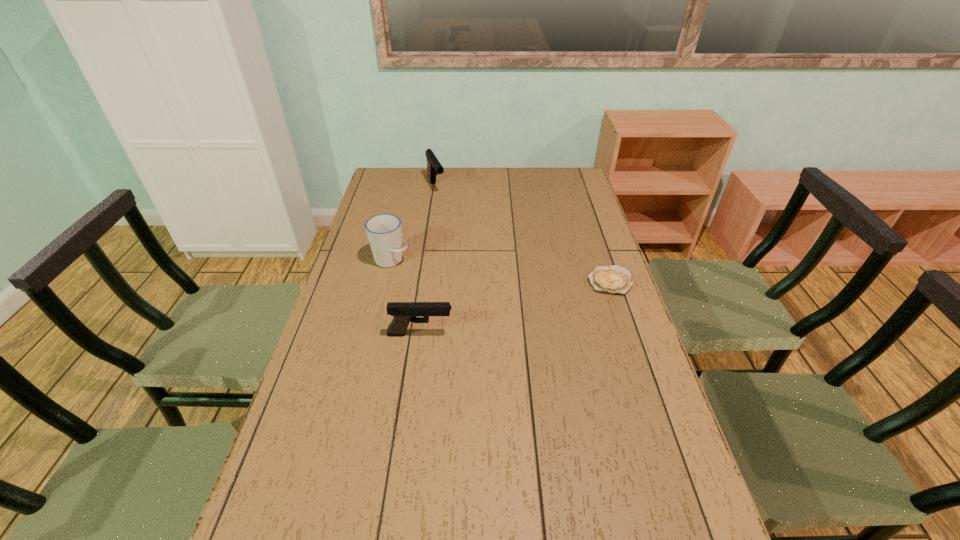
The height and width of the screenshot is (540, 960). In order to click on vacant space at the right edge of the desktop in this screenshot , I will do `click(651, 459)`.

Find the location of a particular element. vacant region at the far left corner of the desktop is located at coordinates (409, 175).

Locate an element on the screen. free area in between the third tallest object and the farther pistol is located at coordinates (428, 261).

You are a GUI agent. You are given a task and a screenshot of the screen. Output one action in this format:
    pyautogui.click(x=<x>, y=<y>)
    Task: Click on the vacant space that is in between the nearest object and the quiche
    The width and height of the screenshot is (960, 540).
    Given the screenshot: What is the action you would take?
    pyautogui.click(x=515, y=307)

Find the location of a particular element. Image resolution: width=960 pixels, height=540 pixels. vacant area that lies between the taller pistol and the rightmost object is located at coordinates (523, 234).

You are a GUI agent. You are given a task and a screenshot of the screen. Output one action in this format:
    pyautogui.click(x=<x>, y=<y>)
    Task: Click on the empty space that is in between the quiche and the taller pistol
    
    Given the screenshot: What is the action you would take?
    pyautogui.click(x=523, y=234)

This screenshot has height=540, width=960. I want to click on free area in between the quiche and the taller pistol, so click(523, 234).

This screenshot has height=540, width=960. In order to click on free space between the farther pistol and the shortest object in this screenshot , I will do `click(523, 234)`.

Where is `free space between the farther pistol and the cup`? free space between the farther pistol and the cup is located at coordinates (414, 224).

Where is `vacant space that is in between the cup and the rightmost object`? vacant space that is in between the cup and the rightmost object is located at coordinates (501, 271).